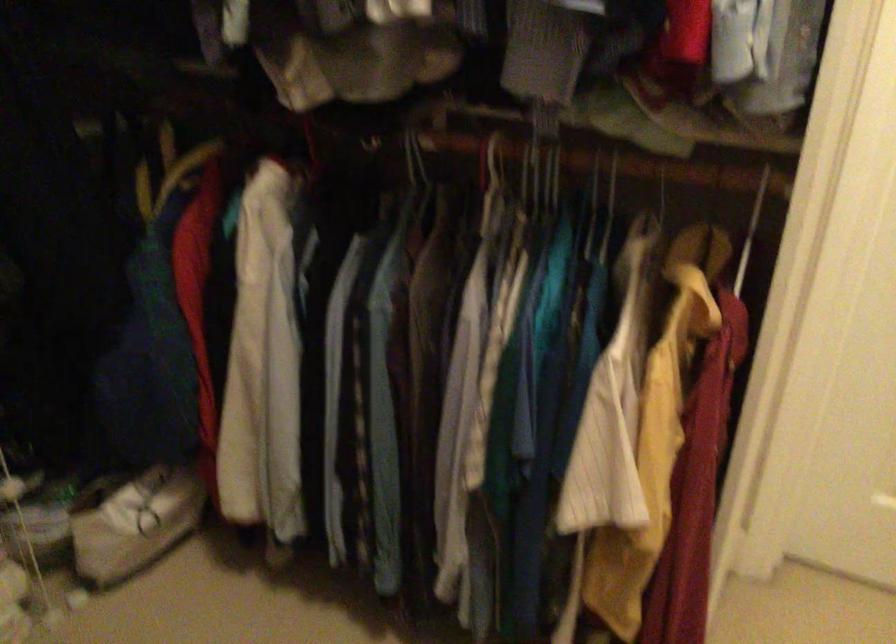
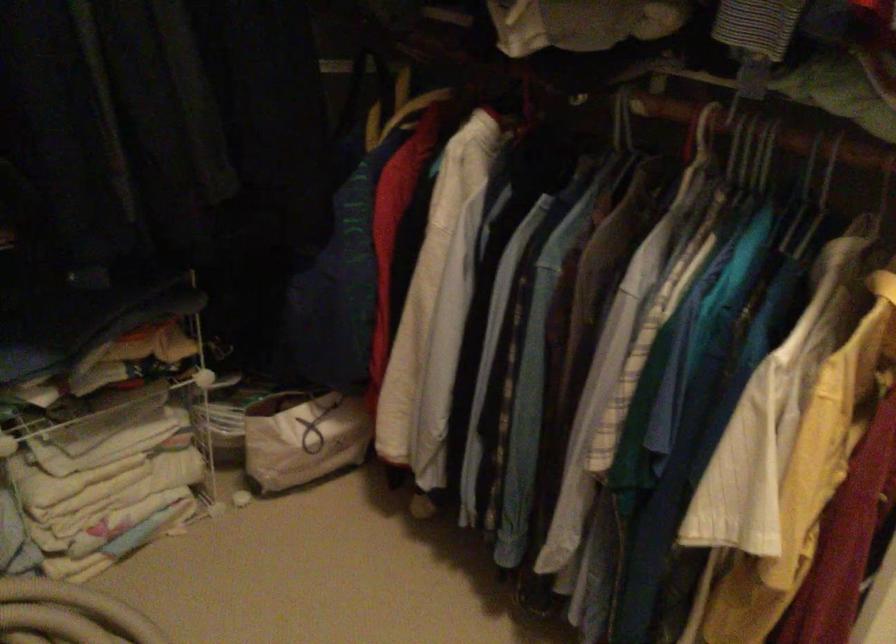
Find the pixel in the second image that matches the point at 557,171 in the first image.

(767, 154)